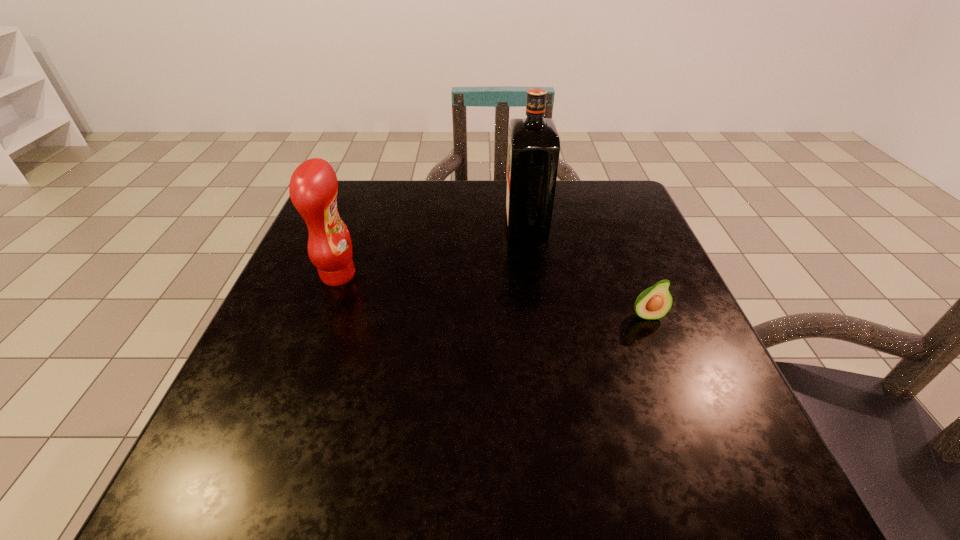
Image resolution: width=960 pixels, height=540 pixels. What are the coordinates of `the tallest object` in the screenshot? It's located at (534, 145).

You are a GUI agent. You are given a task and a screenshot of the screen. Output one action in this format:
    pyautogui.click(x=<x>, y=<y>)
    Task: Click on the farthest object
    
    Given the screenshot: What is the action you would take?
    pyautogui.click(x=534, y=145)

Where is `the second shortest object`? the second shortest object is located at coordinates (313, 187).

Locate an element on the screen. the second nearest object is located at coordinates (313, 187).

This screenshot has height=540, width=960. What are the coordinates of `the shortest object` in the screenshot? It's located at (655, 302).

The height and width of the screenshot is (540, 960). I want to click on the nearest object, so click(x=655, y=302).

Locate an element on the screen. This screenshot has width=960, height=540. free space located 0.260m on the front label of the farthest object is located at coordinates (397, 225).

I want to click on vacant area located on the front label of the farthest object, so click(x=473, y=225).

The height and width of the screenshot is (540, 960). In order to click on vacant space situated 0.080m on the front label of the farthest object in this screenshot , I will do `click(473, 225)`.

Image resolution: width=960 pixels, height=540 pixels. What are the coordinates of `vacant space located on the label side of the condiment` in the screenshot? It's located at (434, 275).